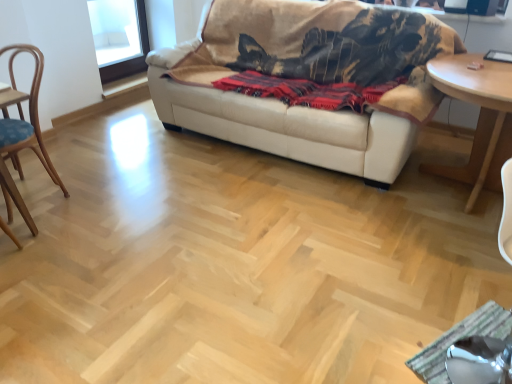
The width and height of the screenshot is (512, 384). Find the location of `free space above light brown wooden table at right (from a real-world perspective)`. free space above light brown wooden table at right (from a real-world perspective) is located at coordinates (482, 67).